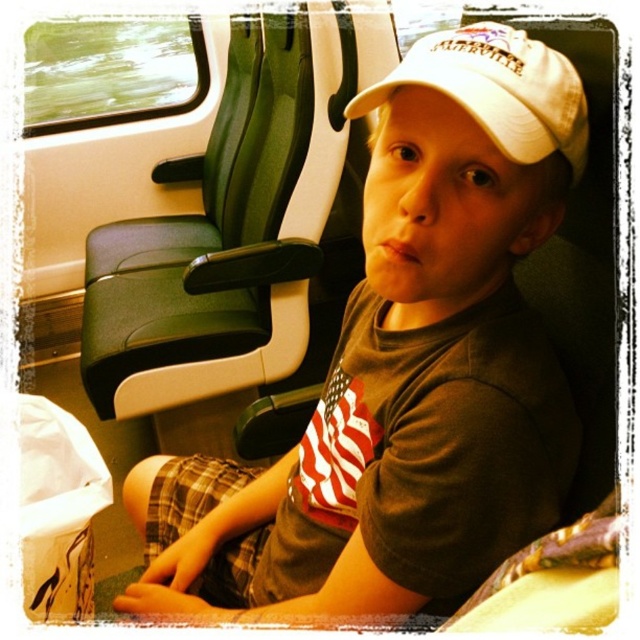
Is point (384, 467) closer to viewer compared to point (497, 49)?

No, it is behind (497, 49).

Who is more distant from viewer, (385, 493) or (454, 96)?

The point (385, 493) is behind.

Locate an element on the screen. The height and width of the screenshot is (640, 640). white matte cap at upper center is located at coordinates (404, 369).